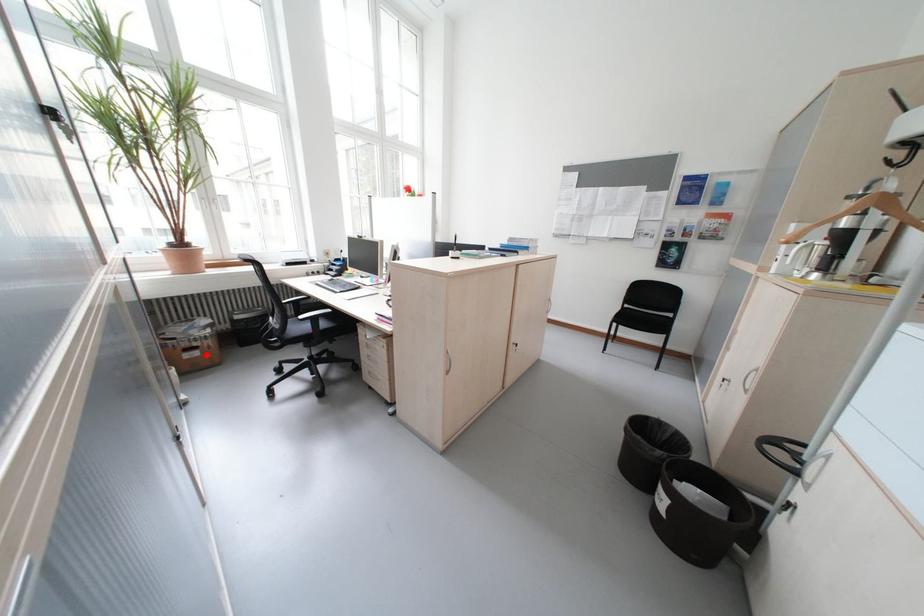
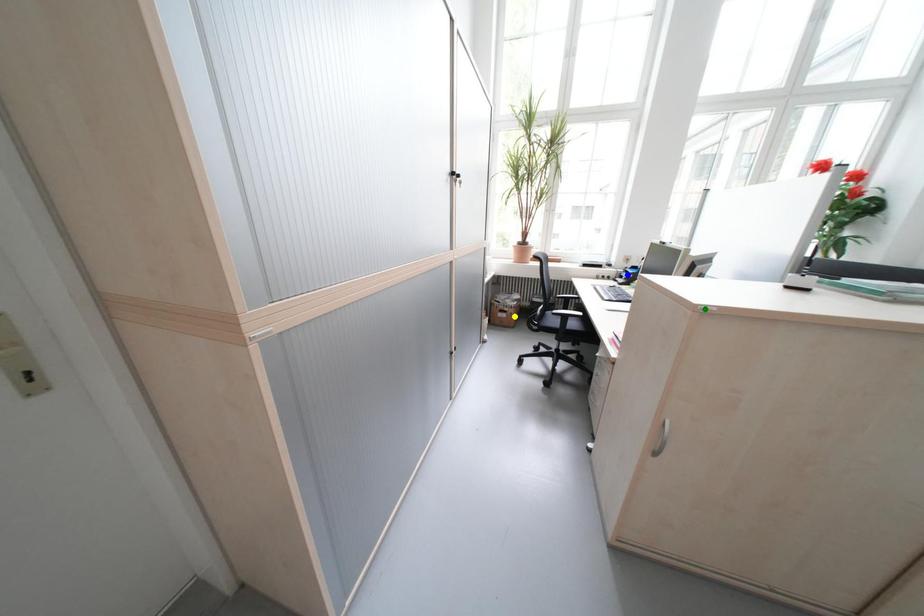
Question: I am providing you with two images of the same scene from different viewpoints. A red point is marked on the first image. You are given multiple points on the second image. Which point in image 2 represents the same 3d spot as the red point in image 1?

Choices:
 (A) green point
 (B) yellow point
 (C) blue point

Answer: (B)